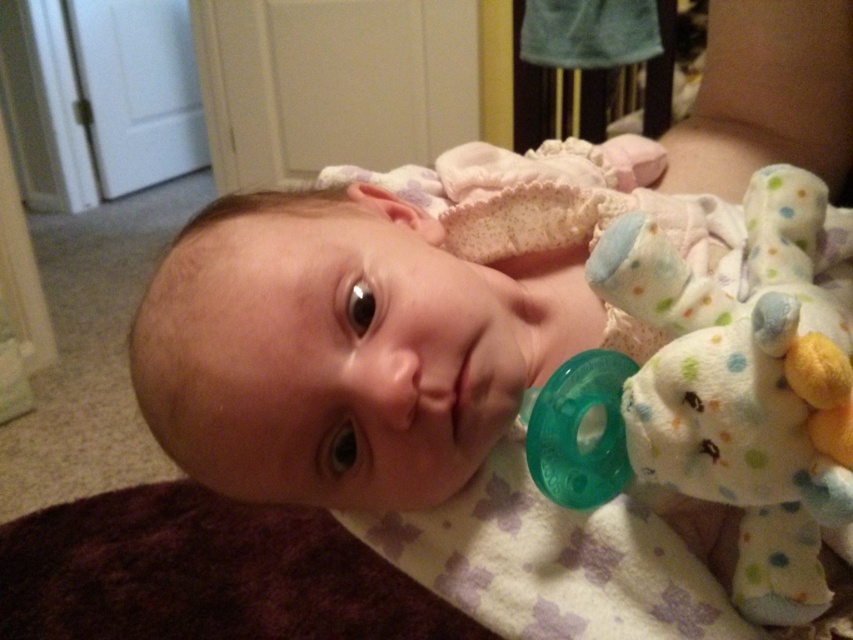
Question: Is white soft baby at center above teeth at center?

Choices:
 (A) yes
 (B) no

Answer: (A)

Question: Can you confirm if white soft baby at center is thinner than white dotted plush toy at right?

Choices:
 (A) yes
 (B) no

Answer: (B)

Question: Which point is farther to the camera?

Choices:
 (A) white soft baby at center
 (B) teeth at center

Answer: (B)

Question: Is white soft baby at center wider than teeth at center?

Choices:
 (A) yes
 (B) no

Answer: (A)

Question: Which of the following is the farthest from the observer?

Choices:
 (A) white dotted plush toy at right
 (B) white soft baby at center
 (C) teeth at center

Answer: (C)

Question: Which point appears farthest from the camera in this image?

Choices:
 (A) (479, 428)
 (B) (846, 282)

Answer: (B)